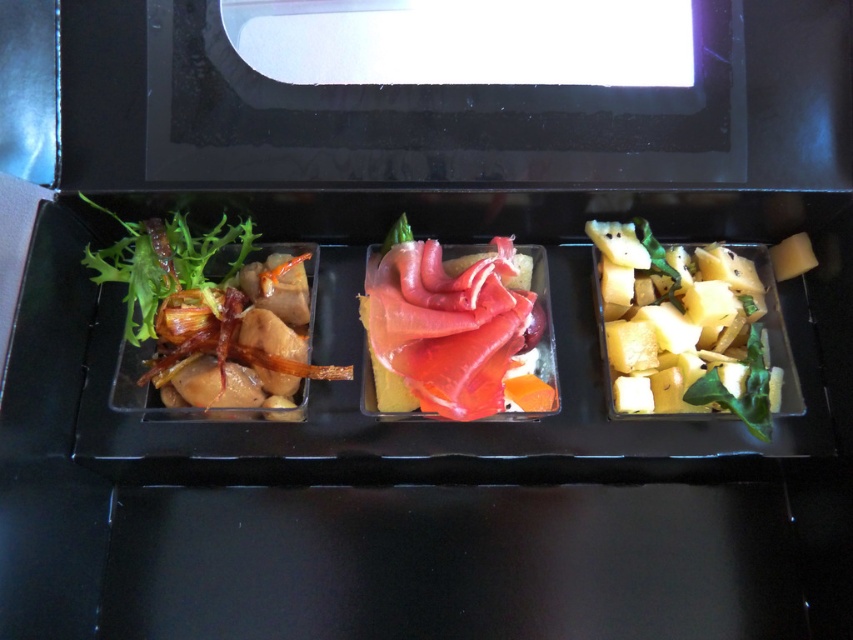
You are a food stylist arranging a photo shoot. You need to place a new dish in the tray between the yellow crumbly cheese at right and the pink raw fish at center. Where should you place it to ensure it is between them?

The yellow crumbly cheese at right is to the right of the pink raw fish at center, so placing the new dish between them would mean positioning it to the left of the yellow crumbly cheese at right and to the right of the pink raw fish at center.

You are a food delivery person who needs to deliver this meal without spilling. The tray has three compartments. The left compartment has the glossy brown salad at left and the middle compartment has the pink raw fish at center. You need to place the tray on a shelf that can only hold items within a 6 inch width. Can the tray fit on the shelf?

The distance between the glossy brown salad at left and the pink raw fish at center is 6.95 inches. Since the shelf can only hold items within a 6 inch width, the tray is wider than the allowed space and cannot fit on the shelf.

In the scene shown: You are a food photographer aiming to capture the yellow crumbly cheese at right in focus while keeping the other dishes in the background slightly blurred. Given that your camera has a depth of field that can sharply focus on objects within a 10 cm range, can you achieve this effect with the current setup?

The yellow crumbly cheese at right is 85.04 centimeters from the camera. Since the depth of field can only sharply focus on objects within a 10 cm range, the distance between the cheese and the camera is too large for the camera to focus on it while keeping the other dishes blurred. Adjust the camera settings or move closer to the cheese to reduce the distance.